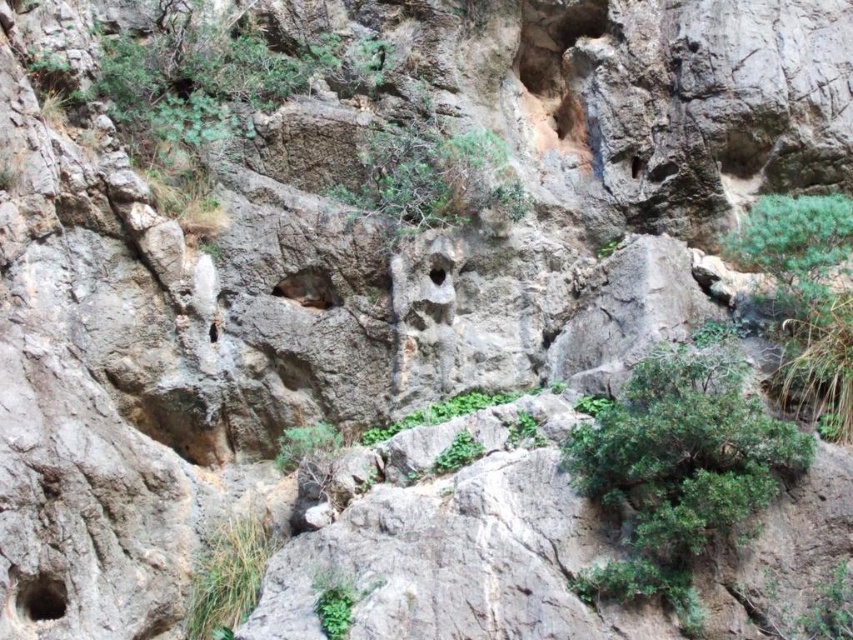
Between point (294, 288) and point (434, 268), which one is positioned in front?

Positioned in front is point (294, 288).

Does brown rough hole at center-left have a greater width compared to smooth stone hole at center?

Yes, brown rough hole at center-left is wider than smooth stone hole at center.

What do you see at coordinates (308, 288) in the screenshot? The width and height of the screenshot is (853, 640). I see `brown rough hole at center-left` at bounding box center [308, 288].

Image resolution: width=853 pixels, height=640 pixels. Identify the location of brown rough hole at center-left. (308, 288).

Where is `green grass at lower left`? The width and height of the screenshot is (853, 640). green grass at lower left is located at coordinates (230, 573).

Looking at this image, does green grass at lower left have a lesser height compared to smooth stone hole at center?

Incorrect, green grass at lower left's height does not fall short of smooth stone hole at center's.

Between point (236, 620) and point (430, 275), which one is positioned in front?

Point (236, 620) is more forward.

Where is `green grass at lower left`? green grass at lower left is located at coordinates (230, 573).

Is green leafy shrub at center below green grass at lower left?

No, green leafy shrub at center is not below green grass at lower left.

Between green leafy shrub at center and green grass at lower left, which one has more height?

green leafy shrub at center

Does point (469, 180) lie behind point (229, 584)?

Yes, it is behind point (229, 584).

Image resolution: width=853 pixels, height=640 pixels. I want to click on green leafy shrub at center, so click(433, 173).